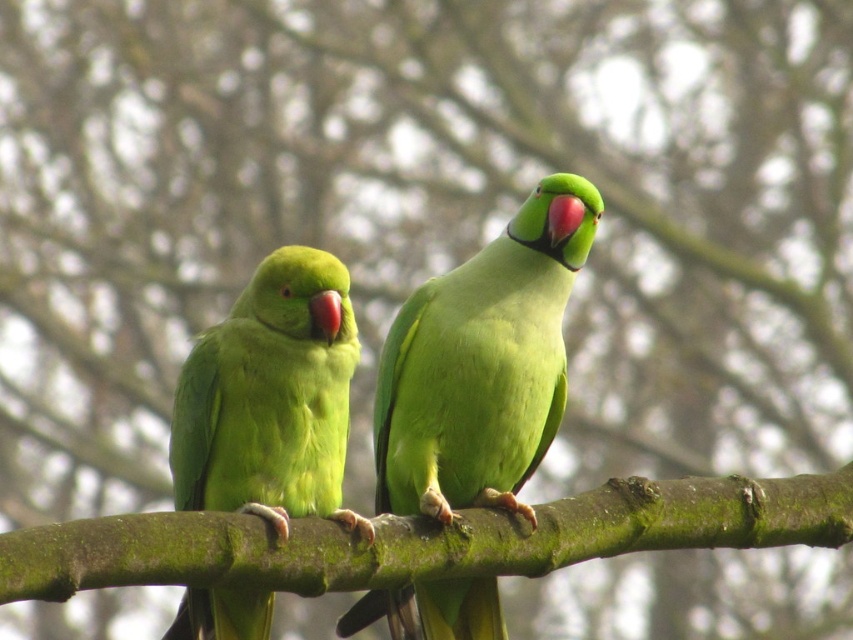
Can you confirm if green mossy branch at center is bigger than green matte parrot at left?

Yes.

Is green mossy branch at center above green matte parrot at left?

No.

I want to click on green mossy branch at center, so click(424, 538).

Can you confirm if green matte parrot at center is smaller than green matte parrot at left?

No, green matte parrot at center is not smaller than green matte parrot at left.

Is the position of green matte parrot at center more distant than that of green matte parrot at left?

Yes, it is.

Does point (460, 342) lie behind point (258, 604)?

That is True.

Where is `green matte parrot at center`? The height and width of the screenshot is (640, 853). green matte parrot at center is located at coordinates (482, 364).

Where is `green mossy branch at center`? The height and width of the screenshot is (640, 853). green mossy branch at center is located at coordinates (424, 538).

Where is `green mossy branch at center`? green mossy branch at center is located at coordinates (424, 538).